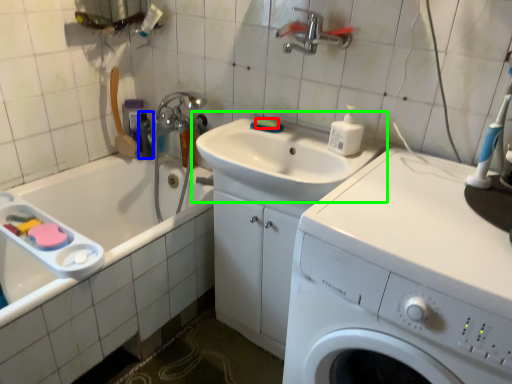
Question: Estimate the real-world distances between objects in this image. Which object is closer to soap (highlighted by a red box), toiletry (highlighted by a blue box) or sink (highlighted by a green box)?

Choices:
 (A) toiletry
 (B) sink

Answer: (B)